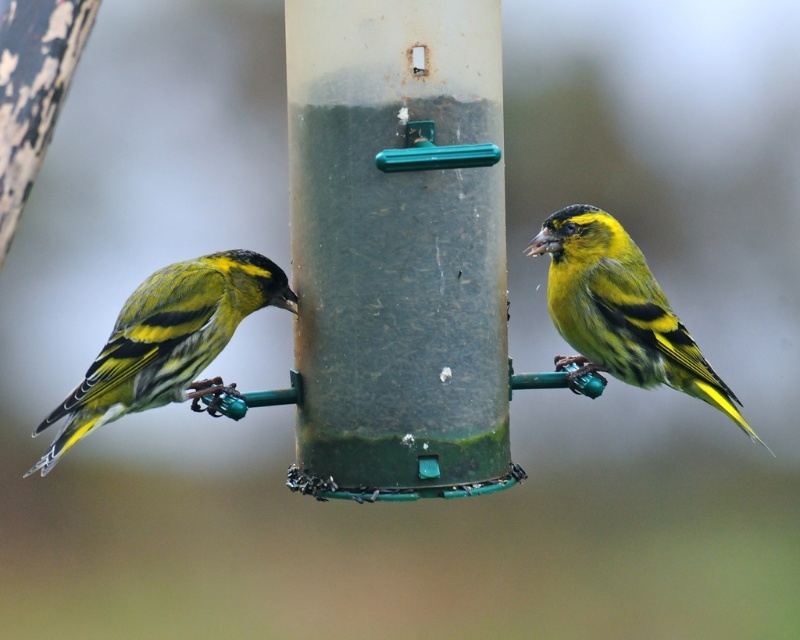
Question: Which point is closer to the camera?

Choices:
 (A) (122, 410)
 (B) (444, 449)

Answer: (B)

Question: Which of the following is the closest to the observer?

Choices:
 (A) (624, 328)
 (B) (254, 300)
 (C) (320, 20)

Answer: (C)

Question: Which of the following is the farthest from the observer?

Choices:
 (A) green textured finch at left
 (B) green matte pole at center

Answer: (A)

Question: From the image, what is the correct spatial relationship of green matte pole at center in relation to yellow-green feathers at right?

Choices:
 (A) left
 (B) right

Answer: (A)

Question: Observing the image, what is the correct spatial positioning of green matte pole at center in reference to yellow-green feathers at right?

Choices:
 (A) below
 (B) above

Answer: (B)

Question: Is green matte pole at center positioned behind yellow-green feathers at right?

Choices:
 (A) yes
 (B) no

Answer: (B)